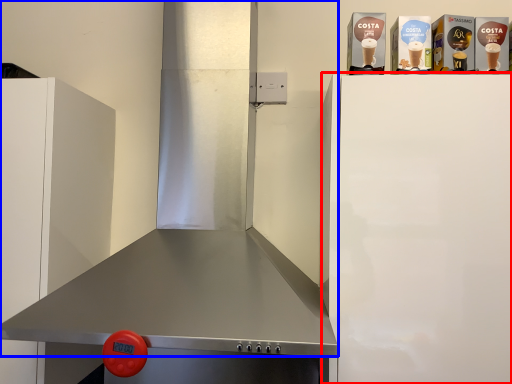
Question: Among these objects, which one is farthest to the camera, appliance (highlighted by a red box) or exhaust hood (highlighted by a blue box)?

Choices:
 (A) appliance
 (B) exhaust hood

Answer: (A)